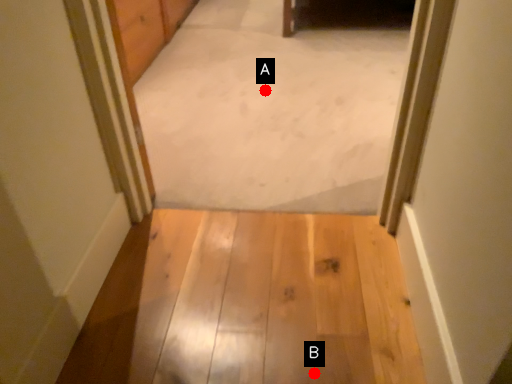
Question: Two points are circled on the image, labeled by A and B beside each circle. Which point is further to the camera?

Choices:
 (A) A is further
 (B) B is further

Answer: (A)